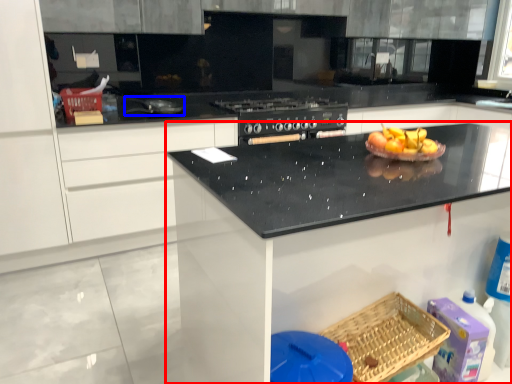
Question: Which point is further to the camera, countertop (highlighted by a red box) or appliance (highlighted by a blue box)?

Choices:
 (A) countertop
 (B) appliance

Answer: (B)